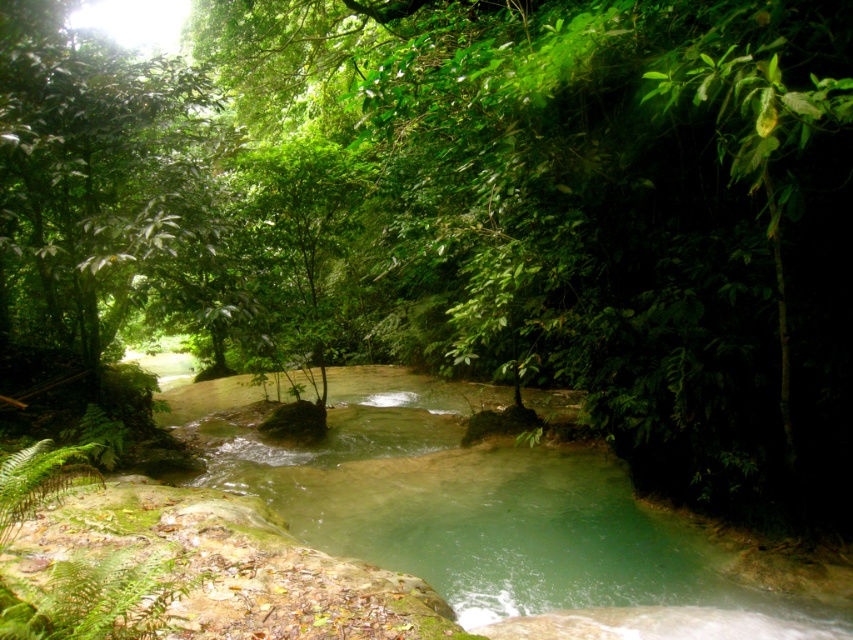
Does clear water at center have a greater height compared to green leafy tree at upper left?

In fact, clear water at center may be shorter than green leafy tree at upper left.

Between clear water at center and green leafy tree at upper left, which one has less height?

With less height is clear water at center.

Is point (457, 557) positioned after point (97, 202)?

No, (457, 557) is closer to viewer.

This screenshot has height=640, width=853. What are the coordinates of `clear water at center` in the screenshot? It's located at (483, 513).